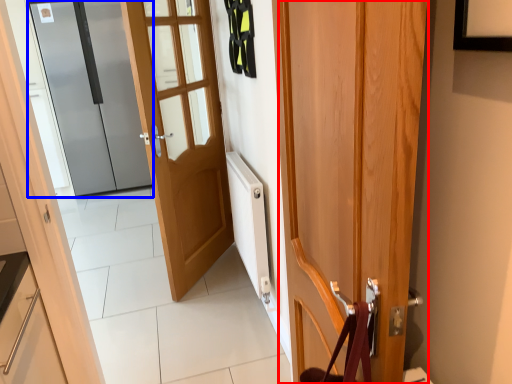
Question: Which object is further to the camera taking this photo, door (highlighted by a red box) or door (highlighted by a blue box)?

Choices:
 (A) door
 (B) door

Answer: (B)